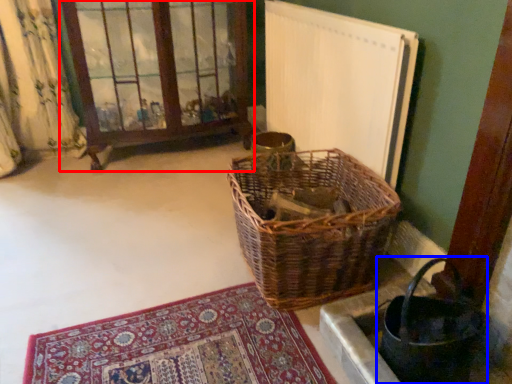
Question: Which point is closer to the camera, window frame (highlighted by a red box) or basket (highlighted by a blue box)?

Choices:
 (A) window frame
 (B) basket

Answer: (B)